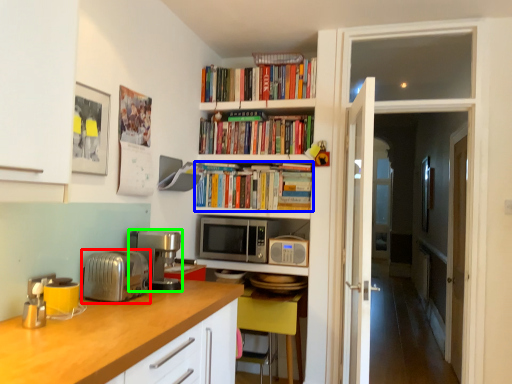
Question: Which is nearer to the toaster (highlighted by a red box)? book (highlighted by a blue box) or coffee machine (highlighted by a green box).

Choices:
 (A) book
 (B) coffee machine

Answer: (B)